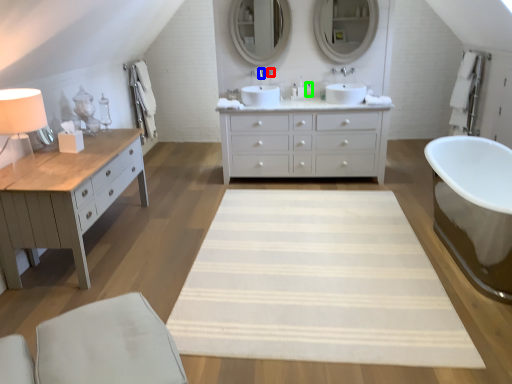
Question: Considering the real-world distances, which object is closest to faucet (highlighted by a red box)? faucet (highlighted by a blue box) or toiletry (highlighted by a green box).

Choices:
 (A) faucet
 (B) toiletry

Answer: (A)